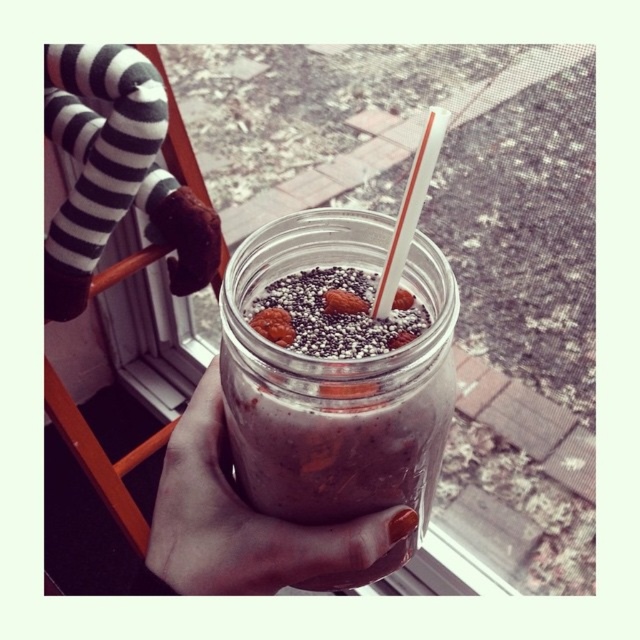
Question: Estimate the real-world distances between objects in this image. Which object is closer to the black striped socks at upper left?

Choices:
 (A) smoothie at center
 (B) matte glass jar at center

Answer: (B)

Question: Can you confirm if smoothie at center is smaller than smooth brown almond at center?

Choices:
 (A) no
 (B) yes

Answer: (A)

Question: Which of the following is the farthest from the observer?

Choices:
 (A) black striped socks at upper left
 (B) matte glass jar at center
 (C) translucent glass jar at center

Answer: (A)

Question: Does translucent glass jar at center appear on the right side of smooth brown almond at center?

Choices:
 (A) no
 (B) yes

Answer: (A)

Question: Which point is farther to the camera?

Choices:
 (A) (349, 515)
 (B) (282, 344)
 (C) (154, 193)

Answer: (C)

Question: Does smoothie at center have a larger size compared to smooth brown almond at center?

Choices:
 (A) no
 (B) yes

Answer: (B)